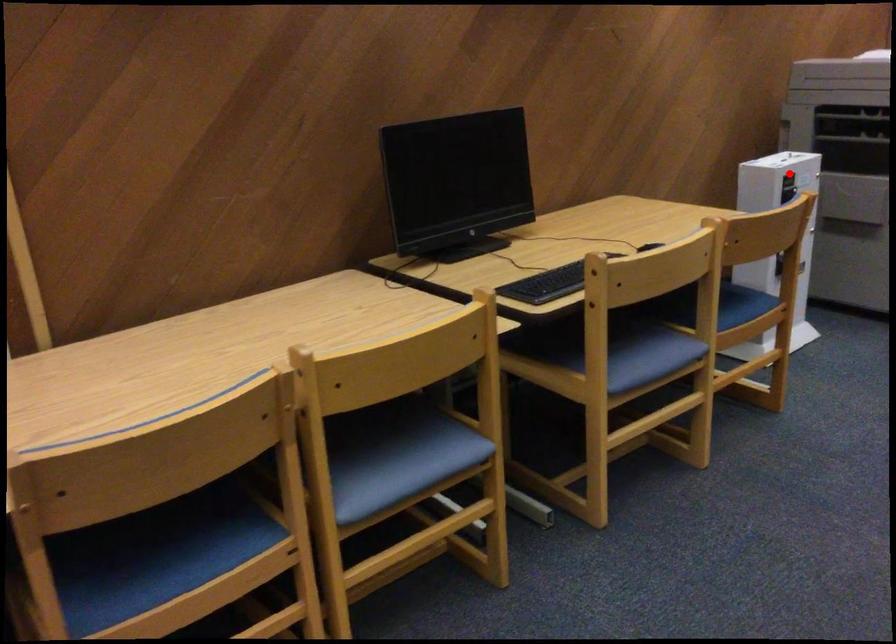
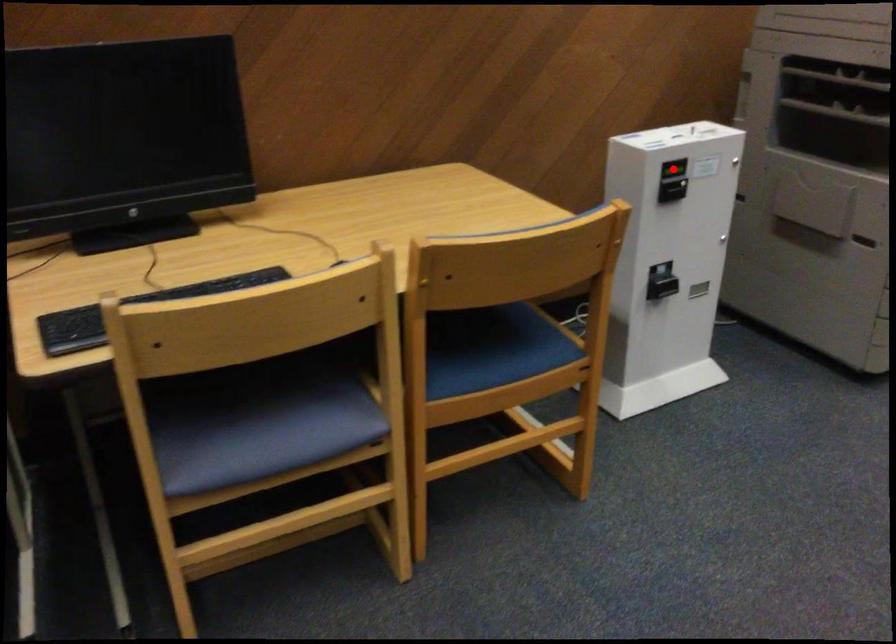
Consider the image. I am providing you with two images of the same scene from different viewpoints. A red point is marked on the first image and another point is marked on the second image. Is the marked point in image1 the same physical position as the marked point in image2?

Yes